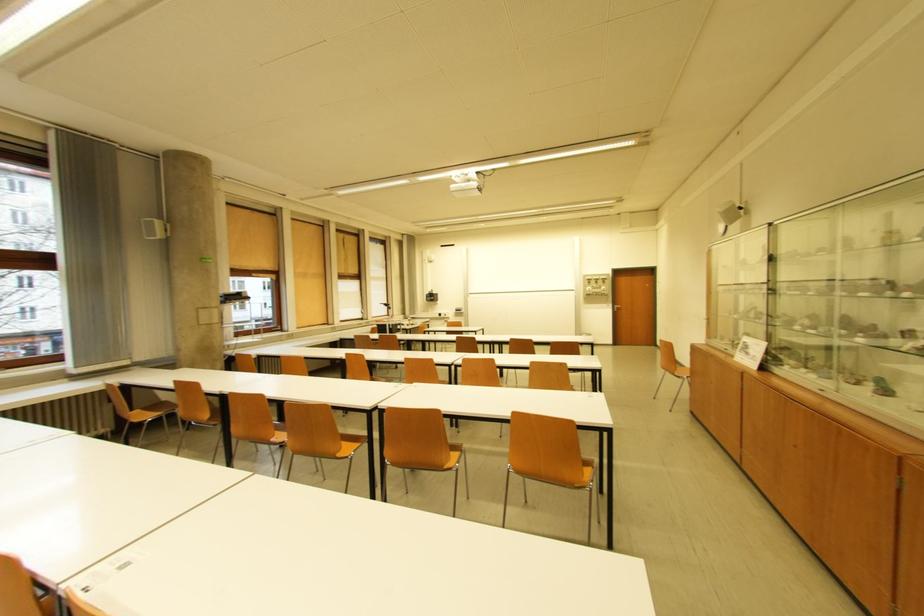
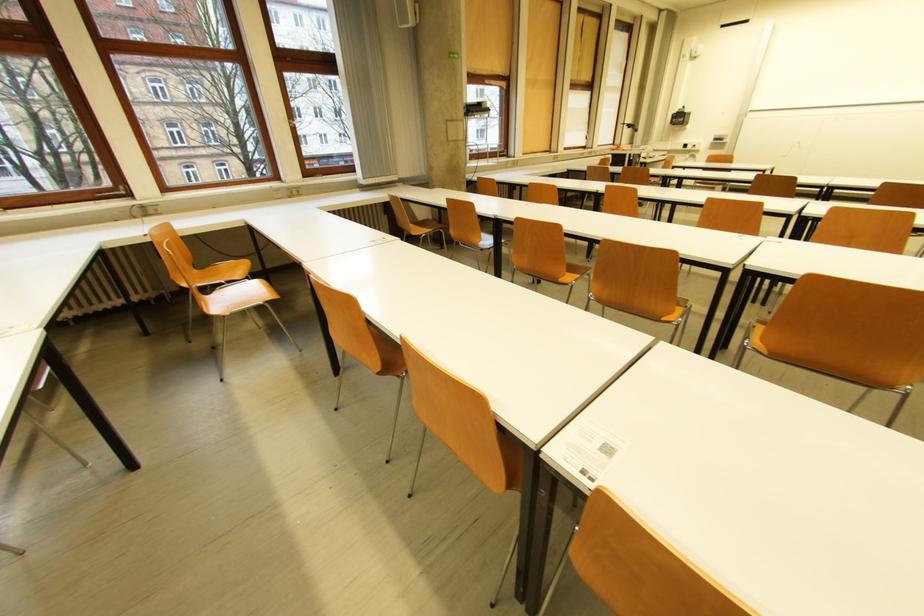
In the second image, find the point that corresponds to point (346, 456) in the first image.

(671, 320)